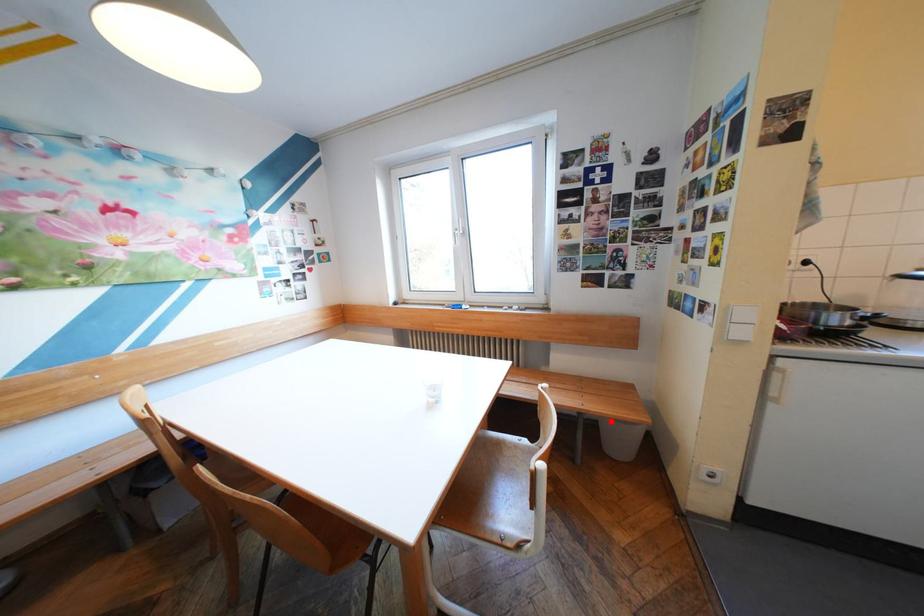
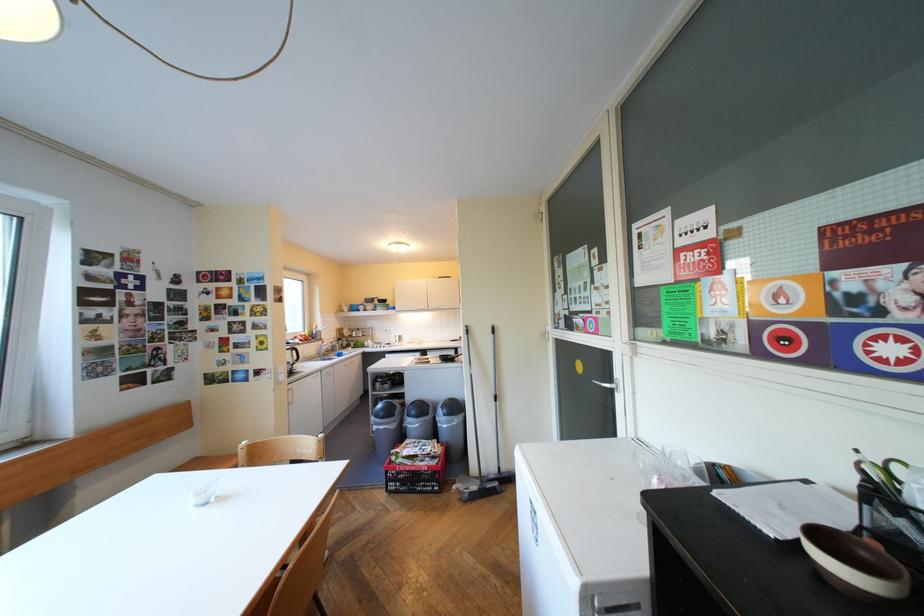
Question: I am providing you with two images of the same scene from different viewpoints. A red point is marked on the first image. Is the red point's position out of view in image 2?

Choices:
 (A) Yes
 (B) No

Answer: (A)